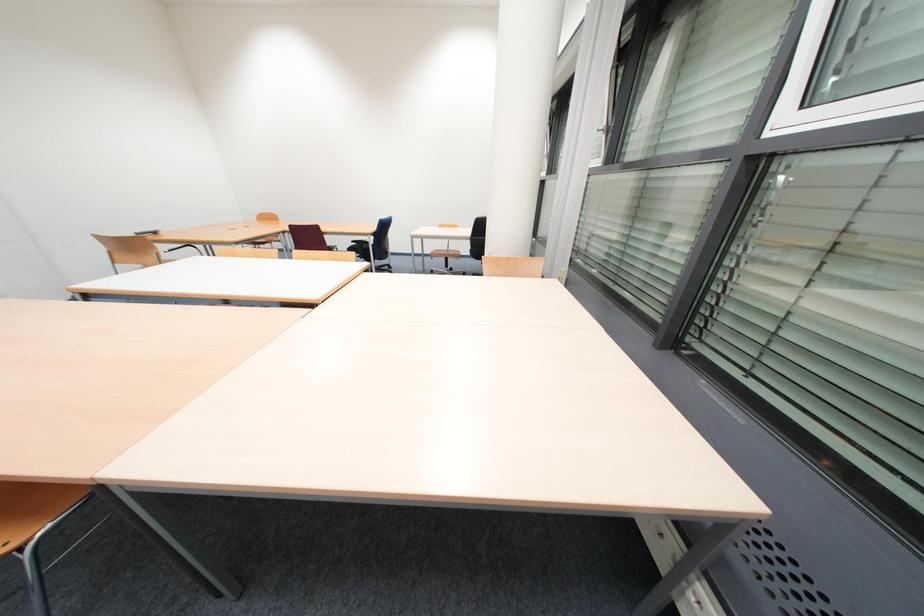
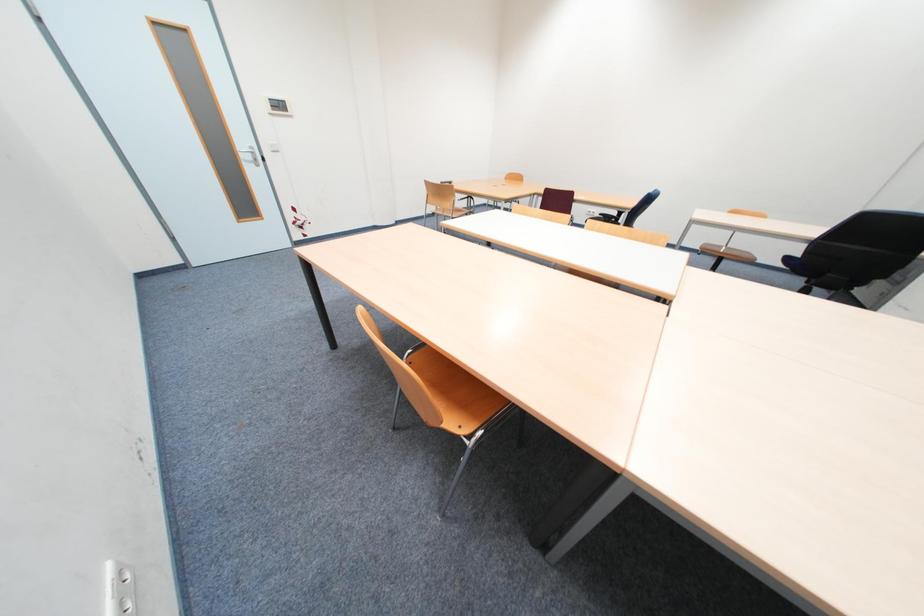
Question: The first image is from the beginning of the video and the second image is from the end. How did the camera likely rotate when shooting the video?

Choices:
 (A) Left
 (B) Right
 (C) Up
 (D) Down

Answer: (A)